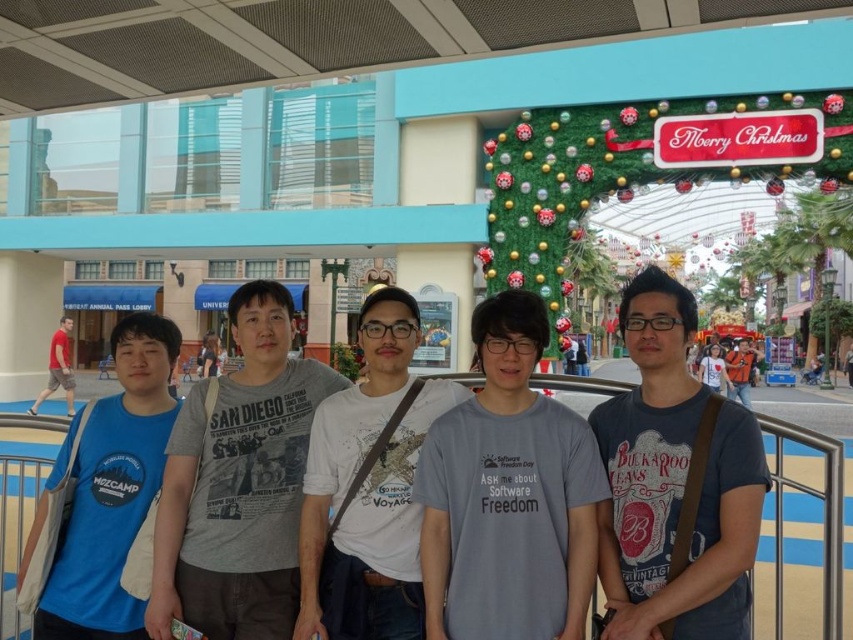
What do you see at coordinates (238, 483) in the screenshot? Image resolution: width=853 pixels, height=640 pixels. I see `gray printed t-shirt at center` at bounding box center [238, 483].

Does gray printed t-shirt at center have a greater width compared to blue cotton t-shirt at left?

In fact, gray printed t-shirt at center might be narrower than blue cotton t-shirt at left.

Who is more distant from viewer, (299, 412) or (126, 476)?

Point (299, 412)

This screenshot has height=640, width=853. What are the coordinates of `gray printed t-shirt at center` in the screenshot? It's located at (238, 483).

Where is `gray printed t-shirt at center`? gray printed t-shirt at center is located at coordinates (238, 483).

The width and height of the screenshot is (853, 640). What do you see at coordinates (238, 483) in the screenshot?
I see `gray printed t-shirt at center` at bounding box center [238, 483].

The width and height of the screenshot is (853, 640). Identify the location of gray printed t-shirt at center. (238, 483).

What do you see at coordinates (508, 496) in the screenshot?
I see `gray cotton t-shirt at center` at bounding box center [508, 496].

Does gray cotton t-shirt at center have a lesser height compared to white cotton t-shirt at center?

Yes, gray cotton t-shirt at center is shorter than white cotton t-shirt at center.

Is point (555, 506) farther from camera compared to point (315, 518)?

No, (555, 506) is closer to viewer.

This screenshot has height=640, width=853. Identify the location of gray cotton t-shirt at center. (508, 496).